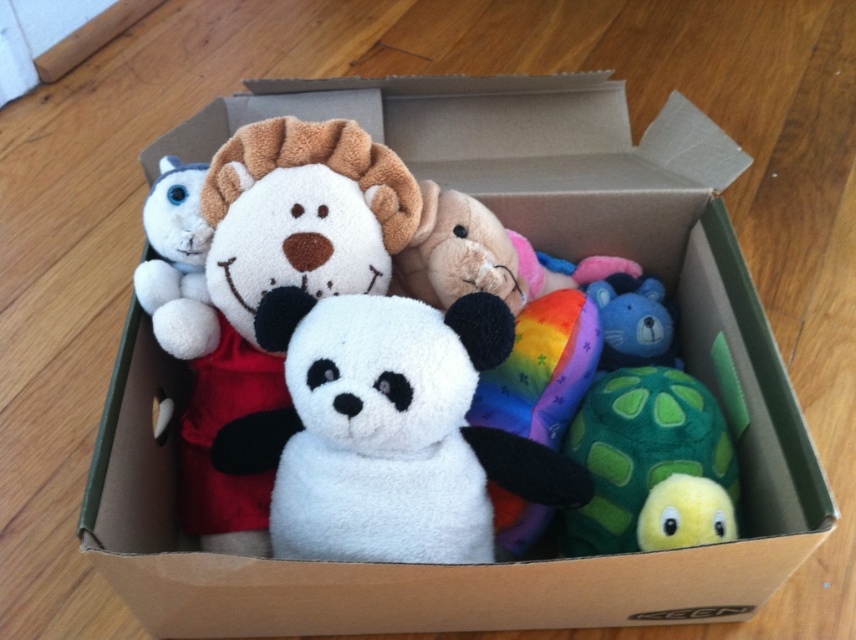
You are organizing plush toys in a cardboard box on a wooden floor. You need to place a new toy at point (611, 348) and another at point (654, 540). According to the existing arrangement, which point is closer to the front of the box?

Point (654, 540) is closer to the front of the box because point (611, 348) is behind it.

You are organizing a toy box and need to place a new toy between the blue plush bear at center and the yellow fuzzy bird at lower right. Based on their positions, where should you place the new toy?

The blue plush bear at center is positioned on the right side of yellow fuzzy bird at lower right, so you should place the new toy between them to the left of the blue plush bear at center and to the right of the yellow fuzzy bird at lower right.